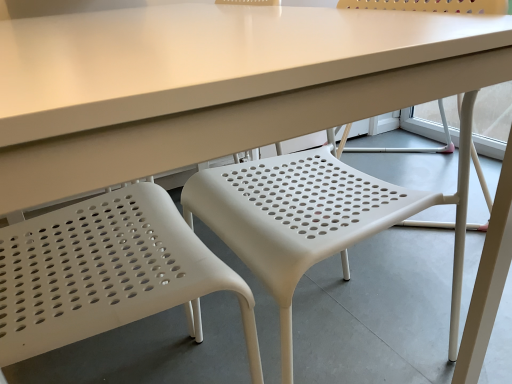
You are a GUI agent. You are given a task and a screenshot of the screen. Output one action in this format:
    pyautogui.click(x=<x>, y=<y>)
    Task: Click on the white plastic chair at center, which appears as the second chair when viewed from the left
    Image resolution: width=512 pixels, height=384 pixels.
    Given the screenshot: What is the action you would take?
    pyautogui.click(x=315, y=218)

How much space does white plastic chair at center, which appears as the second chair when viewed from the left, occupy horizontally?

white plastic chair at center, which appears as the second chair when viewed from the left, is 19.08 inches in width.

Image resolution: width=512 pixels, height=384 pixels. What do you see at coordinates (315, 218) in the screenshot? I see `white plastic chair at center, which appears as the second chair when viewed from the left` at bounding box center [315, 218].

At what (x,y) coordinates should I click in order to perform the action: click on white plastic chair at left, which is the 1th chair from left to right. Please return your answer as a coordinate pair (x, y). Looking at the image, I should click on (106, 273).

Describe the element at coordinates (106, 273) in the screenshot. I see `white plastic chair at left, which is the 2th chair in right-to-left order` at that location.

What are the coordinates of `white plastic chair at center, which appears as the second chair when viewed from the left` in the screenshot? It's located at (315, 218).

Between white plastic chair at center, which is the first chair in right-to-left order, and white plastic chair at left, which is the 1th chair from left to right, which one appears on the left side from the viewer's perspective?

Positioned to the left is white plastic chair at left, which is the 1th chair from left to right.

Relative to white plastic chair at left, which is the 2th chair in right-to-left order, is white plastic chair at center, which appears as the second chair when viewed from the left, in front or behind?

Visually, white plastic chair at center, which appears as the second chair when viewed from the left, is located behind white plastic chair at left, which is the 2th chair in right-to-left order.

Considering the points (230, 205) and (169, 299), which point is in front, point (230, 205) or point (169, 299)?

Positioned in front is point (169, 299).

From the image's perspective, is white plastic chair at center, which is the first chair in right-to-left order, above white plastic chair at left, which is the 2th chair in right-to-left order?

Yes, from the image's perspective, white plastic chair at center, which is the first chair in right-to-left order, is on top of white plastic chair at left, which is the 2th chair in right-to-left order.

From a real-world perspective, between white plastic chair at center, which appears as the second chair when viewed from the left, and white plastic chair at left, which is the 1th chair from left to right, who is vertically lower?

white plastic chair at left, which is the 1th chair from left to right, from a real-world perspective.

Is white plastic chair at center, which appears as the second chair when viewed from the left, wider than white plastic chair at left, which is the 2th chair in right-to-left order?

Yes.

Can you confirm if white plastic chair at center, which is the first chair in right-to-left order, is taller than white plastic chair at left, which is the 2th chair in right-to-left order?

Incorrect, the height of white plastic chair at center, which is the first chair in right-to-left order, is not larger of that of white plastic chair at left, which is the 2th chair in right-to-left order.

Considering the sizes of objects white plastic chair at center, which is the first chair in right-to-left order, and white plastic chair at left, which is the 2th chair in right-to-left order, in the image provided, who is smaller, white plastic chair at center, which is the first chair in right-to-left order, or white plastic chair at left, which is the 2th chair in right-to-left order,?

Smaller between the two is white plastic chair at left, which is the 2th chair in right-to-left order.

Is white plastic chair at center, which appears as the second chair when viewed from the left, situated inside white plastic chair at left, which is the 1th chair from left to right, or outside?

white plastic chair at center, which appears as the second chair when viewed from the left, lies outside white plastic chair at left, which is the 1th chair from left to right.

From the picture: Is white plastic chair at center, which is the first chair in right-to-left order, not close to white plastic chair at left, which is the 1th chair from left to right?

Actually, white plastic chair at center, which is the first chair in right-to-left order, and white plastic chair at left, which is the 1th chair from left to right, are a little close together.

Is white plastic chair at center, which is the first chair in right-to-left order, turned away from white plastic chair at left, which is the 1th chair from left to right?

That's right, white plastic chair at center, which is the first chair in right-to-left order, is facing away from white plastic chair at left, which is the 1th chair from left to right.

How many degrees apart are the facing directions of white plastic chair at center, which is the first chair in right-to-left order, and white plastic chair at left, which is the 2th chair in right-to-left order?

white plastic chair at center, which is the first chair in right-to-left order, and white plastic chair at left, which is the 2th chair in right-to-left order, are facing 180 degrees away from each other.

Measure the distance from white plastic chair at center, which is the first chair in right-to-left order, to white plastic chair at left, which is the 1th chair from left to right.

white plastic chair at center, which is the first chair in right-to-left order, is 23.10 centimeters from white plastic chair at left, which is the 1th chair from left to right.

This screenshot has height=384, width=512. What are the coordinates of `chair on the right of white plastic chair at left, which is the 1th chair from left to right` in the screenshot? It's located at (315, 218).

Which object is positioned more to the right, white plastic chair at left, which is the 2th chair in right-to-left order, or white plastic chair at center, which is the first chair in right-to-left order?

white plastic chair at center, which is the first chair in right-to-left order, is more to the right.

Is the position of white plastic chair at left, which is the 1th chair from left to right, less distant than that of white plastic chair at center, which appears as the second chair when viewed from the left?

Yes, white plastic chair at left, which is the 1th chair from left to right, is in front of white plastic chair at center, which appears as the second chair when viewed from the left.

Is point (61, 334) positioned in front of point (212, 200)?

Yes.

From the picture: From the image's perspective, would you say white plastic chair at left, which is the 2th chair in right-to-left order, is shown under white plastic chair at center, which is the first chair in right-to-left order?

Correct, white plastic chair at left, which is the 2th chair in right-to-left order, appears lower than white plastic chair at center, which is the first chair in right-to-left order, in the image.

From a real-world perspective, is white plastic chair at left, which is the 2th chair in right-to-left order, positioned over white plastic chair at center, which appears as the second chair when viewed from the left, based on gravity?

No, from a real-world perspective, white plastic chair at left, which is the 2th chair in right-to-left order, is not on top of white plastic chair at center, which appears as the second chair when viewed from the left.

Is white plastic chair at left, which is the 1th chair from left to right, wider or thinner than white plastic chair at center, which appears as the second chair when viewed from the left?

In the image, white plastic chair at left, which is the 1th chair from left to right, appears to be more narrow than white plastic chair at center, which appears as the second chair when viewed from the left.

In terms of height, does white plastic chair at left, which is the 2th chair in right-to-left order, look taller or shorter compared to white plastic chair at center, which appears as the second chair when viewed from the left?

Clearly, white plastic chair at left, which is the 2th chair in right-to-left order, is taller compared to white plastic chair at center, which appears as the second chair when viewed from the left.

Does white plastic chair at left, which is the 1th chair from left to right, have a larger size compared to white plastic chair at center, which is the first chair in right-to-left order?

Actually, white plastic chair at left, which is the 1th chair from left to right, might be smaller than white plastic chair at center, which is the first chair in right-to-left order.

Is white plastic chair at left, which is the 1th chair from left to right, located outside white plastic chair at center, which is the first chair in right-to-left order?

white plastic chair at left, which is the 1th chair from left to right, is positioned outside white plastic chair at center, which is the first chair in right-to-left order.

In the scene shown: Are white plastic chair at left, which is the 1th chair from left to right, and white plastic chair at center, which appears as the second chair when viewed from the left, far apart?

No, there isn't a large distance between white plastic chair at left, which is the 1th chair from left to right, and white plastic chair at center, which appears as the second chair when viewed from the left.

Does white plastic chair at left, which is the 2th chair in right-to-left order, turn towards white plastic chair at center, which appears as the second chair when viewed from the left?

Yes, white plastic chair at left, which is the 2th chair in right-to-left order, is oriented towards white plastic chair at center, which appears as the second chair when viewed from the left.

You are a GUI agent. You are given a task and a screenshot of the screen. Output one action in this format:
    pyautogui.click(x=<x>, y=<y>)
    Task: Click on the chair on the left side of white plastic chair at center, which is the first chair in right-to-left order
    Image resolution: width=512 pixels, height=384 pixels.
    Given the screenshot: What is the action you would take?
    pyautogui.click(x=106, y=273)

Identify the location of chair that is on the left side of white plastic chair at center, which appears as the second chair when viewed from the left. The width and height of the screenshot is (512, 384). (106, 273).

You are a GUI agent. You are given a task and a screenshot of the screen. Output one action in this format:
    pyautogui.click(x=<x>, y=<y>)
    Task: Click on the chair that appears on the right of white plastic chair at left, which is the 2th chair in right-to-left order
    This screenshot has height=384, width=512.
    Given the screenshot: What is the action you would take?
    pyautogui.click(x=315, y=218)